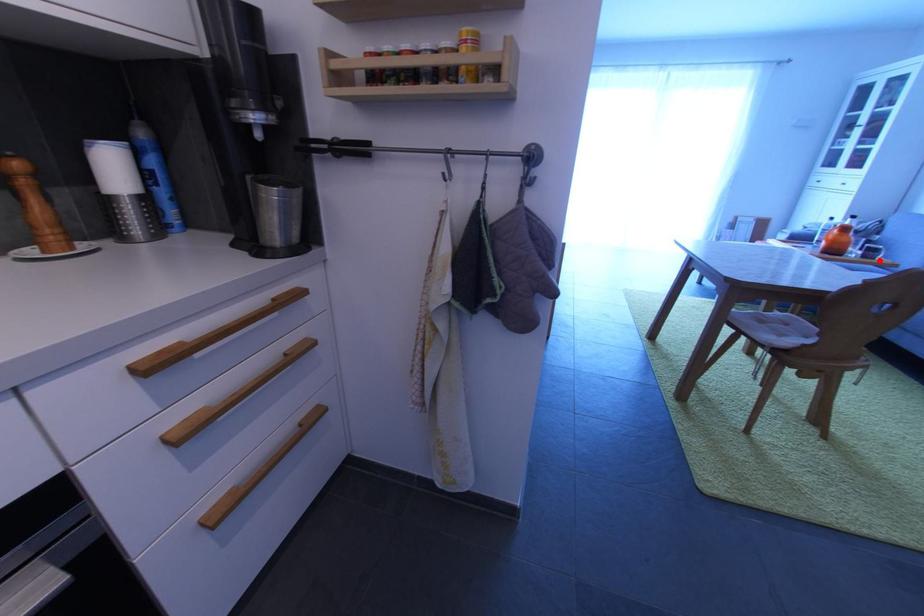
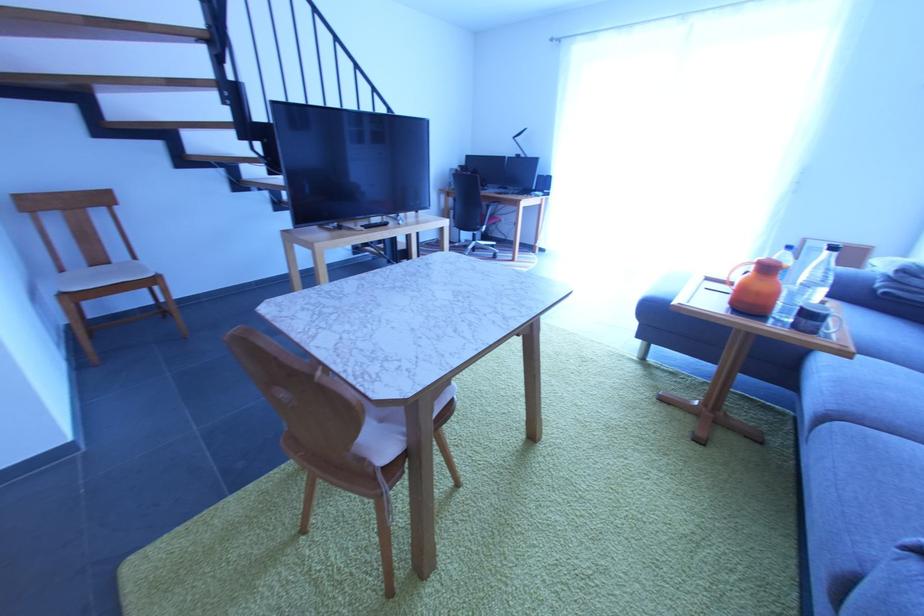
Locate, in the second image, the point that corresponds to the highlighted location in the first image.

(819, 334)